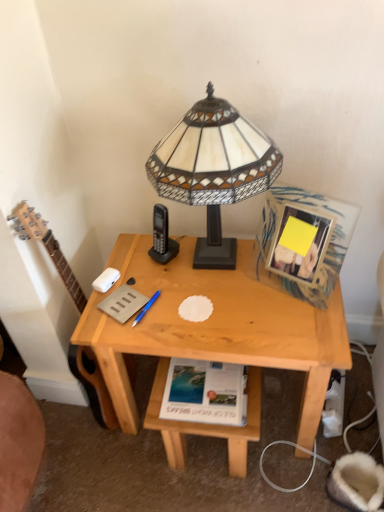
This screenshot has height=512, width=384. What are the coordinates of `empty space that is in between natural wood table at lower center and light wood desk at center` in the screenshot? It's located at (221, 464).